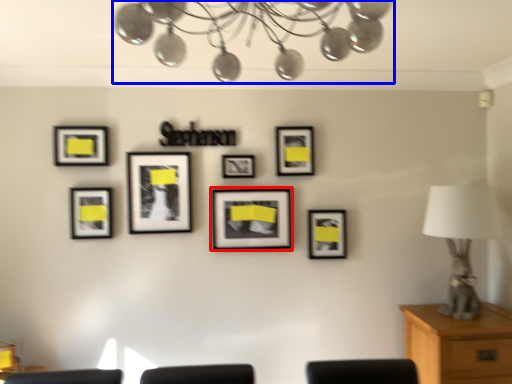
Question: Which point is further to the camera, picture frame (highlighted by a red box) or lamp (highlighted by a blue box)?

Choices:
 (A) picture frame
 (B) lamp

Answer: (A)